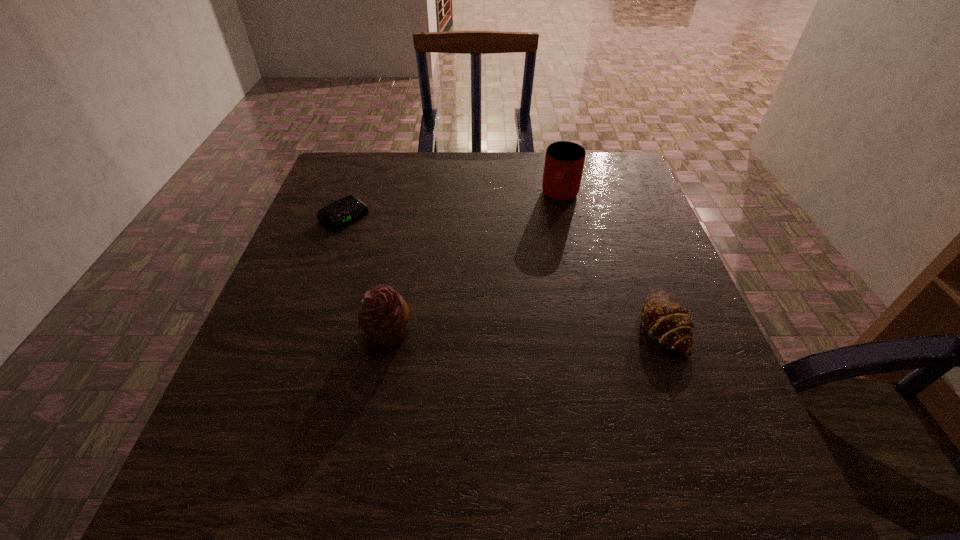
Identify the location of cupcake. The image size is (960, 540). (383, 315).

Locate an element on the screen. the rightmost object is located at coordinates (666, 321).

At what (x,y) coordinates should I click in order to perform the action: click on crescent roll. Please return your answer as a coordinate pair (x, y). The height and width of the screenshot is (540, 960). Looking at the image, I should click on (666, 321).

Find the location of a particular element. Image resolution: width=960 pixels, height=540 pixels. cup is located at coordinates (564, 161).

The width and height of the screenshot is (960, 540). In order to click on alarm clock in this screenshot , I will do `click(349, 208)`.

The height and width of the screenshot is (540, 960). In order to click on the leftmost object in this screenshot , I will do `click(349, 208)`.

Find the location of `free space located on the right of the cupcake`. free space located on the right of the cupcake is located at coordinates (472, 330).

Find the location of a particular element. vacant space located on the left of the rightmost object is located at coordinates (519, 325).

At what (x,y) coordinates should I click in order to perform the action: click on free region located on the handle side of the second object from right to left. Please return your answer as a coordinate pair (x, y). Image resolution: width=960 pixels, height=540 pixels. Looking at the image, I should click on (531, 287).

This screenshot has height=540, width=960. What are the coordinates of `free point located on the handle side of the second object from right to left` in the screenshot? It's located at (517, 324).